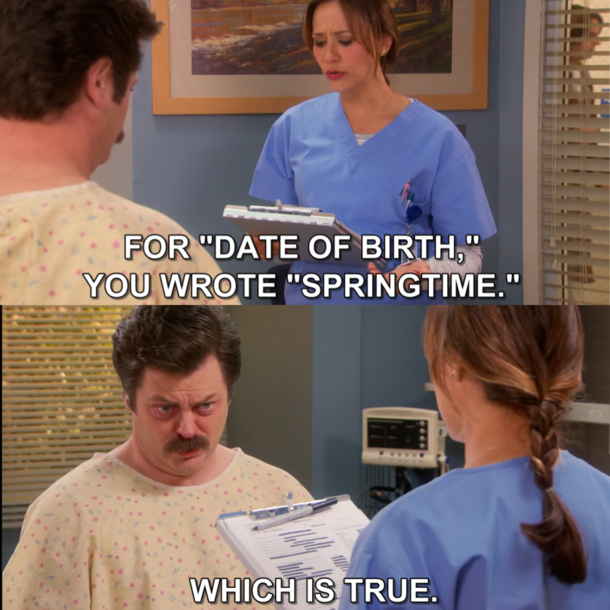
Where is `brown clipboard`? This screenshot has height=610, width=610. brown clipboard is located at coordinates (285, 231), (271, 511).